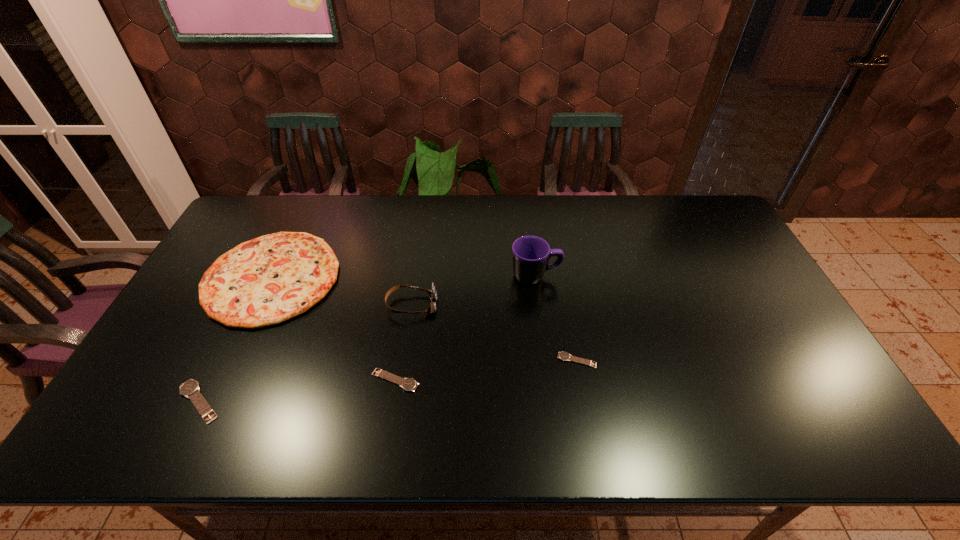
Locate an element on the screen. The width and height of the screenshot is (960, 540). blank space that satisfies the following two spatial constraints: 1. on the front-facing side of the second tallest object; 2. on the back side of the shortest object is located at coordinates (403, 360).

I want to click on vacant area that satisfies the following two spatial constraints: 1. on the front side of the third tallest object; 2. on the right side of the rightmost watch, so click(x=233, y=360).